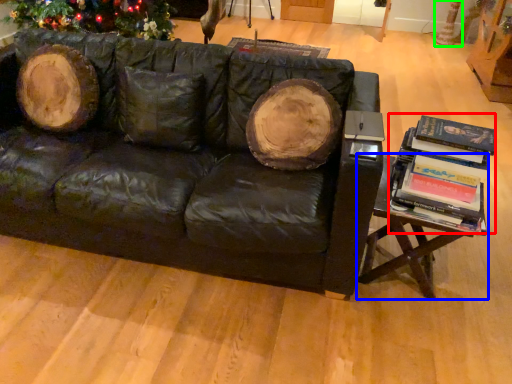
Question: Estimate the real-world distances between objects in this image. Which object is closer to book (highlighted by a red box), table (highlighted by a blue box) or tree trunk (highlighted by a green box)?

Choices:
 (A) table
 (B) tree trunk

Answer: (A)